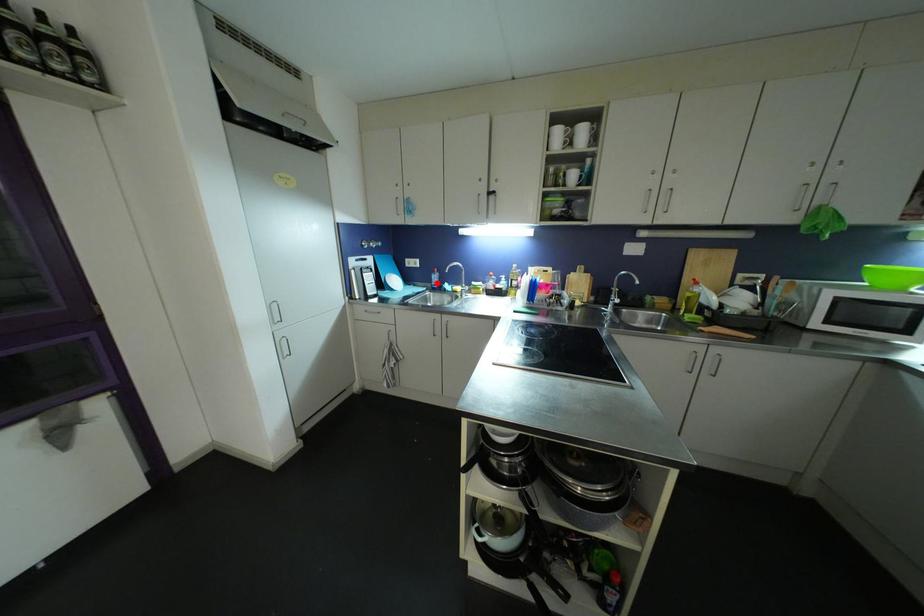
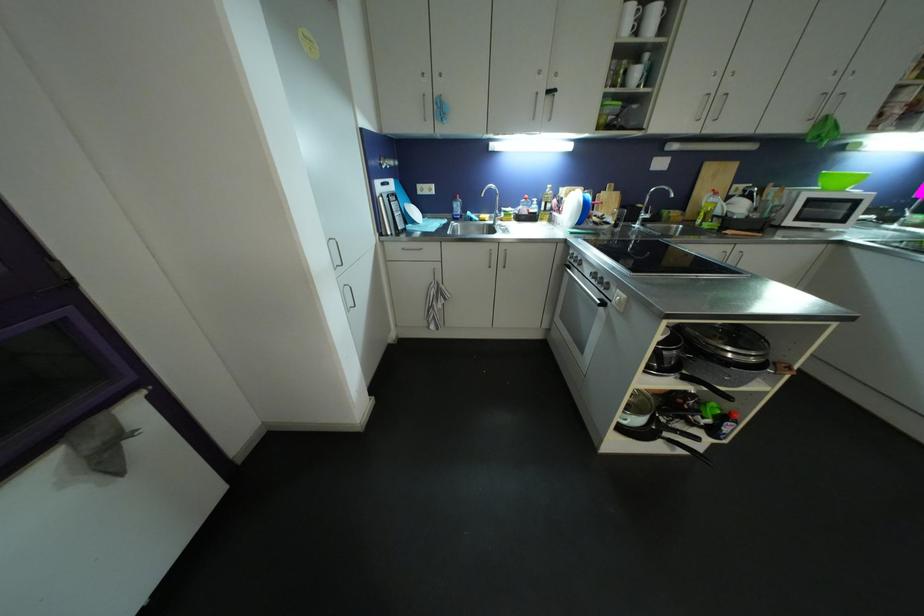
Locate, in the second image, the point that corresponds to the highlighted location in the first image.

(457, 213)